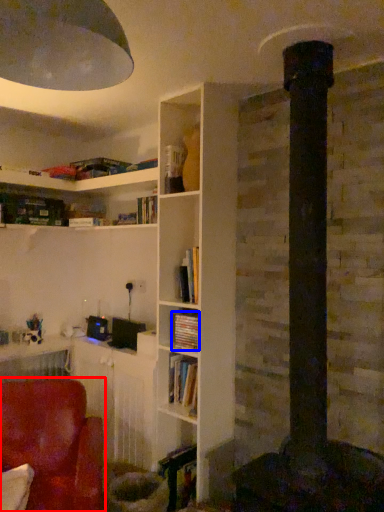
Question: Which point is further to the camera, chair (highlighted by a red box) or book (highlighted by a blue box)?

Choices:
 (A) chair
 (B) book

Answer: (B)